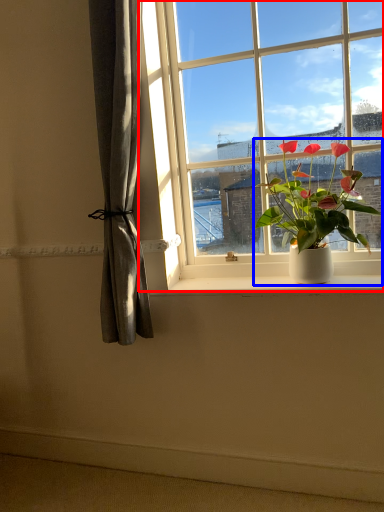
Question: Which point is closer to the camera, window (highlighted by a red box) or houseplant (highlighted by a blue box)?

Choices:
 (A) window
 (B) houseplant

Answer: (B)